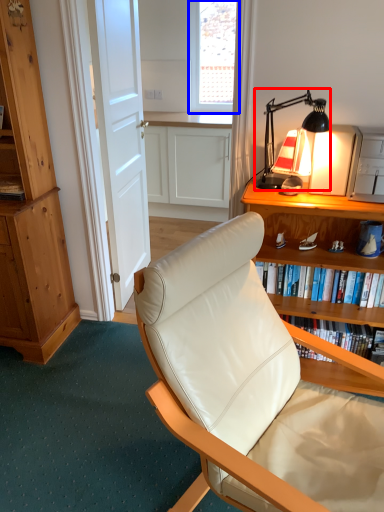
Question: Which of the following is the closest to the observer, lamp (highlighted by a red box) or window screen (highlighted by a blue box)?

Choices:
 (A) lamp
 (B) window screen

Answer: (A)